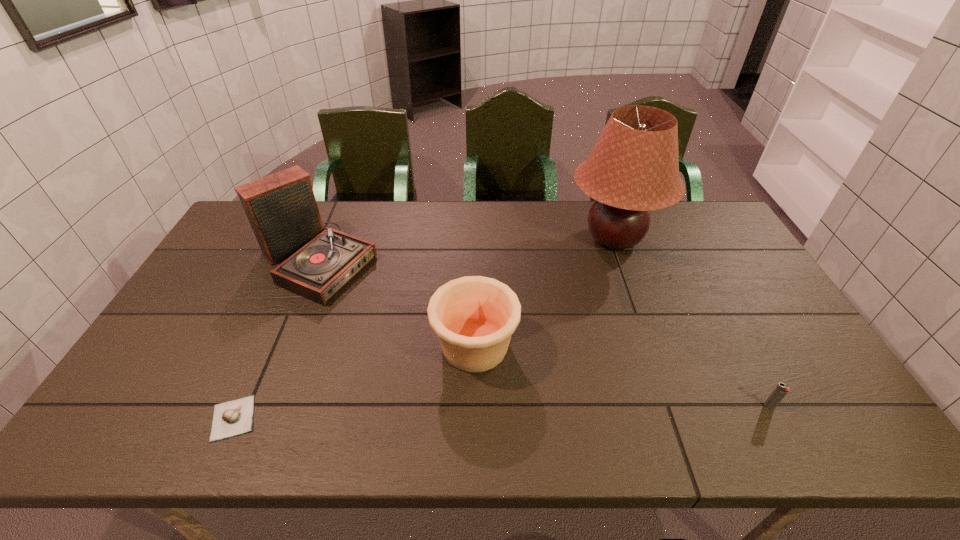
Locate an element on the screen. object identified as the second closest to the tallest object is located at coordinates (781, 390).

Where is `vacant space that satisfies the following two spatial constraints: 1. on the front-facing side of the fourth tallest object; 2. on the right side of the fourth object from left to right`? The height and width of the screenshot is (540, 960). vacant space that satisfies the following two spatial constraints: 1. on the front-facing side of the fourth tallest object; 2. on the right side of the fourth object from left to right is located at coordinates (674, 406).

Find the location of a particular element. vacant space that satisfies the following two spatial constraints: 1. on the back side of the shortest object; 2. on the left side of the igniter is located at coordinates (238, 406).

This screenshot has width=960, height=540. I want to click on vacant position in the image that satisfies the following two spatial constraints: 1. on the back side of the garlic; 2. on the right side of the igniter, so click(x=238, y=406).

Locate an element on the screen. The image size is (960, 540). vacant region that satisfies the following two spatial constraints: 1. on the front-facing side of the fourth object from left to right; 2. on the right side of the rightmost object is located at coordinates (x=674, y=406).

Locate an element on the screen. free space that satisfies the following two spatial constraints: 1. on the front-facing side of the second object from right to left; 2. on the front side of the third farthest object is located at coordinates (652, 346).